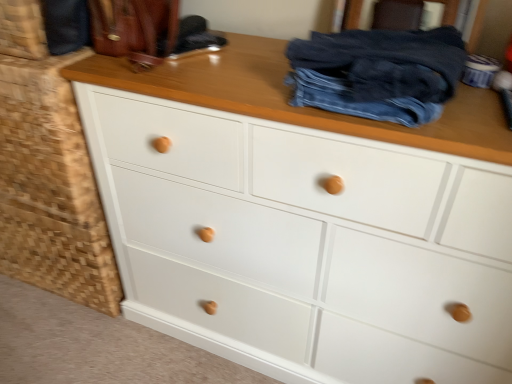
At what (x,y) coordinates should I click in order to perform the action: click on free spot to the left of denim at center. Please return your answer as a coordinate pair (x, y). The width and height of the screenshot is (512, 384). Looking at the image, I should click on (241, 87).